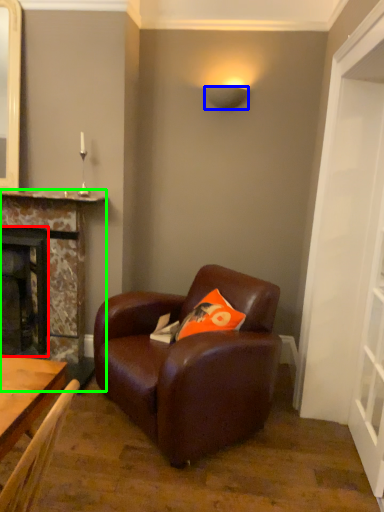
Question: Estimate the real-world distances between objects in this image. Which object is farther from fireplace (highlighted by a red box), lamp (highlighted by a blue box) or fireplace (highlighted by a green box)?

Choices:
 (A) lamp
 (B) fireplace

Answer: (A)